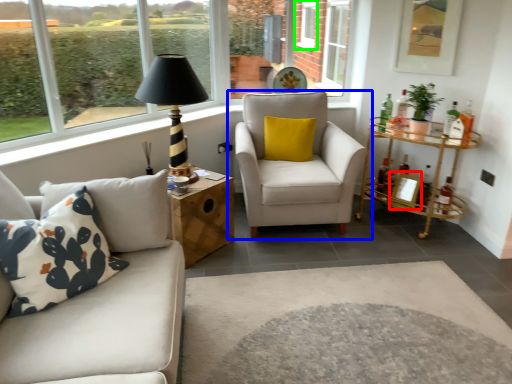
Question: Based on their relative distances, which object is farther from picture frame (highlighted by a red box)? Choose from chair (highlighted by a blue box) and window (highlighted by a green box).

Choices:
 (A) chair
 (B) window

Answer: (B)